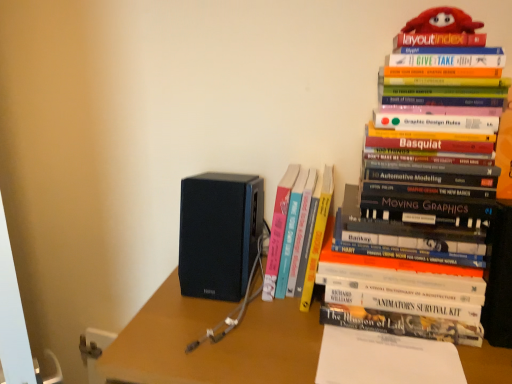
Question: From a real-world perspective, is white paper at center located higher than hardcover book at upper right, arranged as the first book when viewed from the right?

Choices:
 (A) no
 (B) yes

Answer: (A)

Question: Is white paper at center facing away from hardcover book at upper right, arranged as the first book when viewed from the right?

Choices:
 (A) yes
 (B) no

Answer: (A)

Question: Does white paper at center lie in front of hardcover book at upper right, the 2th book viewed from the left?

Choices:
 (A) no
 (B) yes

Answer: (A)

Question: From a real-world perspective, does white paper at center sit lower than hardcover book at upper right, the 2th book viewed from the left?

Choices:
 (A) yes
 (B) no

Answer: (A)

Question: Is white paper at center oriented towards hardcover book at upper right, the 2th book viewed from the left?

Choices:
 (A) yes
 (B) no

Answer: (B)

Question: Considering the positions of point (483, 365) and point (293, 231), is point (483, 365) closer or farther from the camera than point (293, 231)?

Choices:
 (A) closer
 (B) farther

Answer: (A)

Question: Considering their positions, is matte black speaker at center located in front of or behind hardcover book at center, which is the second book in right-to-left order?

Choices:
 (A) front
 (B) behind

Answer: (A)

Question: Is matte black speaker at center wider or thinner than hardcover book at center, arranged as the first book when viewed from the left?

Choices:
 (A) thin
 (B) wide

Answer: (B)

Question: Based on their sizes in the image, would you say matte black speaker at center is bigger or smaller than hardcover book at center, which is the second book in right-to-left order?

Choices:
 (A) big
 (B) small

Answer: (A)

Question: From the image's perspective, is white paper at center located above or below black matte speaker at center?

Choices:
 (A) below
 (B) above

Answer: (A)

Question: Considering their positions, is white paper at center located in front of or behind black matte speaker at center?

Choices:
 (A) behind
 (B) front

Answer: (B)

Question: In terms of height, does white paper at center look taller or shorter compared to black matte speaker at center?

Choices:
 (A) tall
 (B) short

Answer: (B)

Question: From a real-world perspective, is white paper at center above or below black matte speaker at center?

Choices:
 (A) below
 (B) above

Answer: (A)

Question: Considering their positions, is matte black speaker at center located in front of or behind hardcover book at upper right, arranged as the first book when viewed from the right?

Choices:
 (A) behind
 (B) front

Answer: (B)

Question: Is point (499, 380) closer or farther from the camera than point (449, 213)?

Choices:
 (A) closer
 (B) farther

Answer: (A)